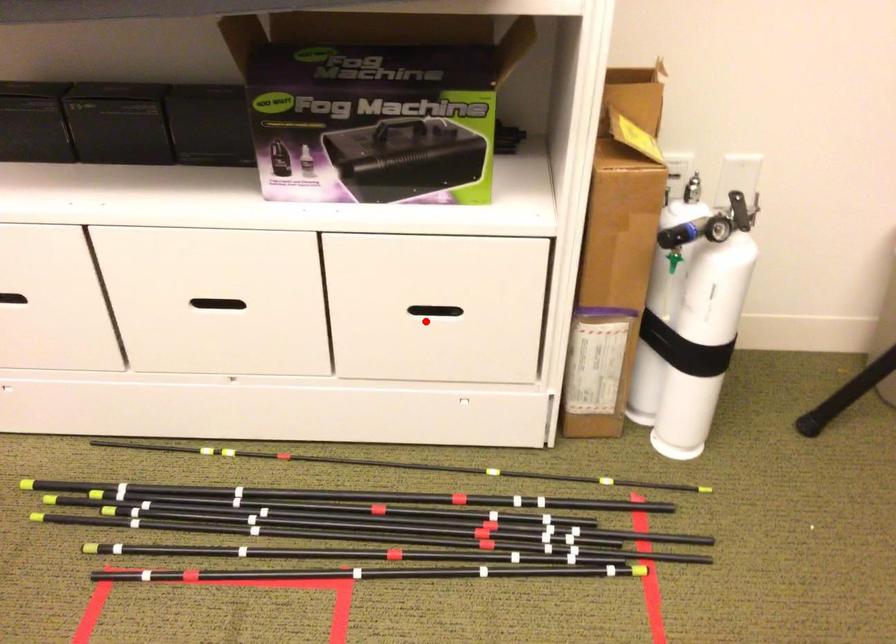
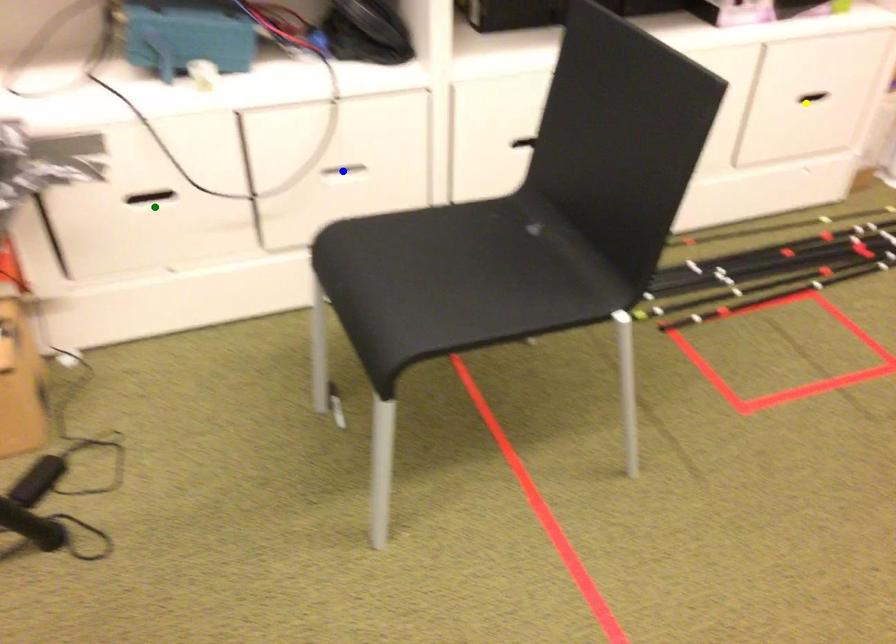
Question: I am providing you with two images of the same scene from different viewpoints. A red point is marked on the first image. You are given multiple points on the second image. Which point in image 2 represents the same 3d spot as the red point in image 1?

Choices:
 (A) blue point
 (B) green point
 (C) yellow point

Answer: (C)